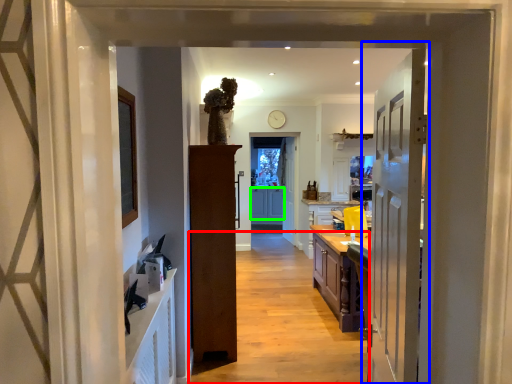
Question: Based on their relative distances, which object is farther from path (highlighted by a red box)? Choose from door (highlighted by a blue box) and cabinetry (highlighted by a green box).

Choices:
 (A) door
 (B) cabinetry

Answer: (B)